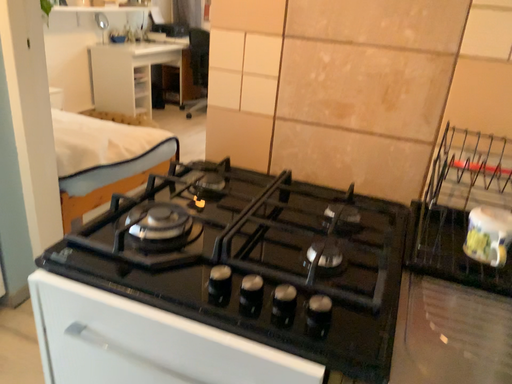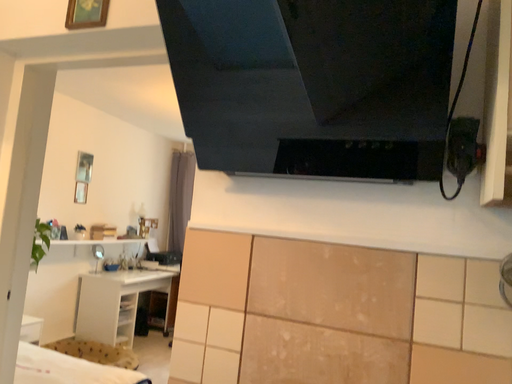
Question: Which way did the camera rotate in the video?

Choices:
 (A) rotated upward
 (B) rotated downward

Answer: (A)